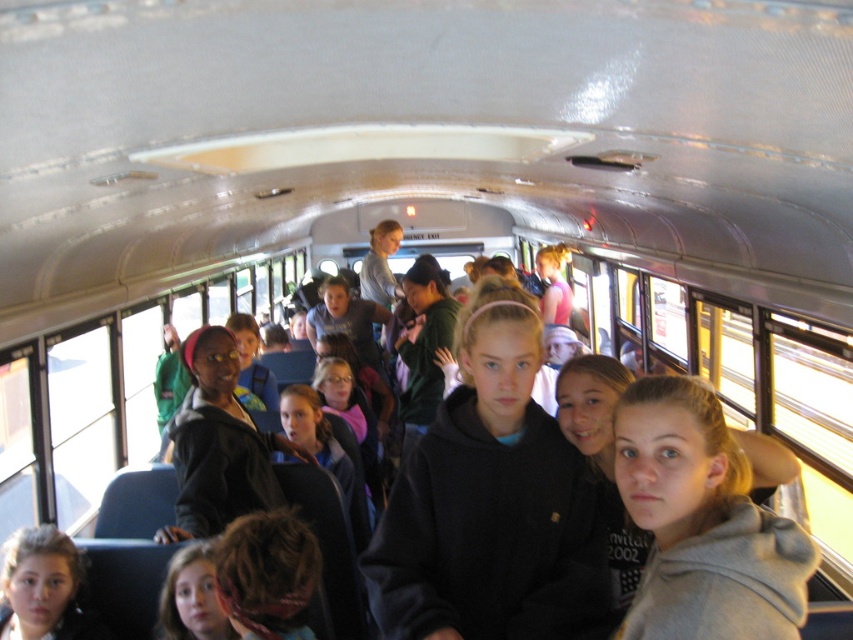
Question: Can you confirm if black matte sweatshirt at center is positioned to the right of matte black hoodie at lower left?

Choices:
 (A) yes
 (B) no

Answer: (A)

Question: Can you confirm if black matte sweatshirt at center is bigger than matte black hoodie at lower left?

Choices:
 (A) yes
 (B) no

Answer: (A)

Question: Is black matte sweatshirt at center positioned behind matte black hoodie at lower left?

Choices:
 (A) no
 (B) yes

Answer: (A)

Question: Which point is farther from the camera taking this photo?

Choices:
 (A) (74, 579)
 (B) (543, 412)

Answer: (A)